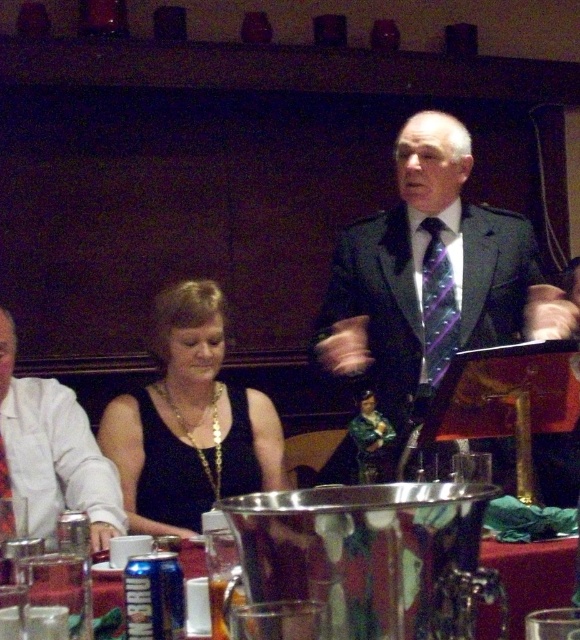
Question: Which of these objects is positioned closest to the black satin dress at center?

Choices:
 (A) purple striped tie at center
 (B) matte black suit at center
 (C) clear glass table at center

Answer: (B)

Question: Does black satin dress at center have a greater width compared to purple satin tie at upper center?

Choices:
 (A) no
 (B) yes

Answer: (B)

Question: Which object is farther from the camera taking this photo?

Choices:
 (A) clear glass table at center
 (B) purple striped tie at center
 (C) white fabric shirt at left
 (D) matte black suit at center

Answer: (B)

Question: Is matte black suit at center positioned before purple satin tie at upper center?

Choices:
 (A) no
 (B) yes

Answer: (A)

Question: Which point is farther to the camera?

Choices:
 (A) (8, 492)
 (B) (430, 250)
 (C) (191, 314)

Answer: (C)

Question: Where is matte black suit at center located in relation to clear glass table at center in the image?

Choices:
 (A) left
 (B) right

Answer: (B)